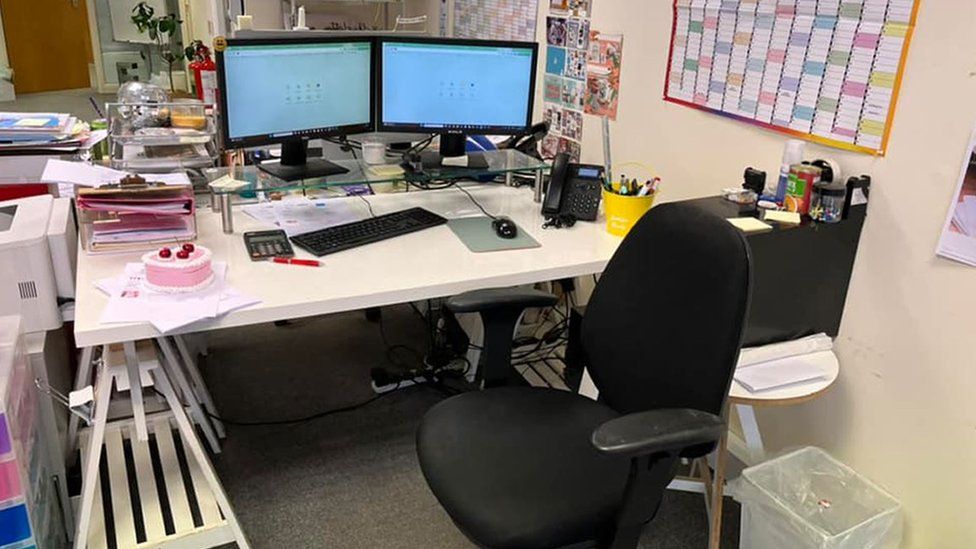
You are a GUI agent. You are given a task and a screenshot of the screen. Output one action in this format:
    pyautogui.click(x=<x>, y=<y>)
    Task: Click on the empty space on wall
    The image size is (976, 549).
    Given the screenshot: What is the action you would take?
    pyautogui.click(x=906, y=187)